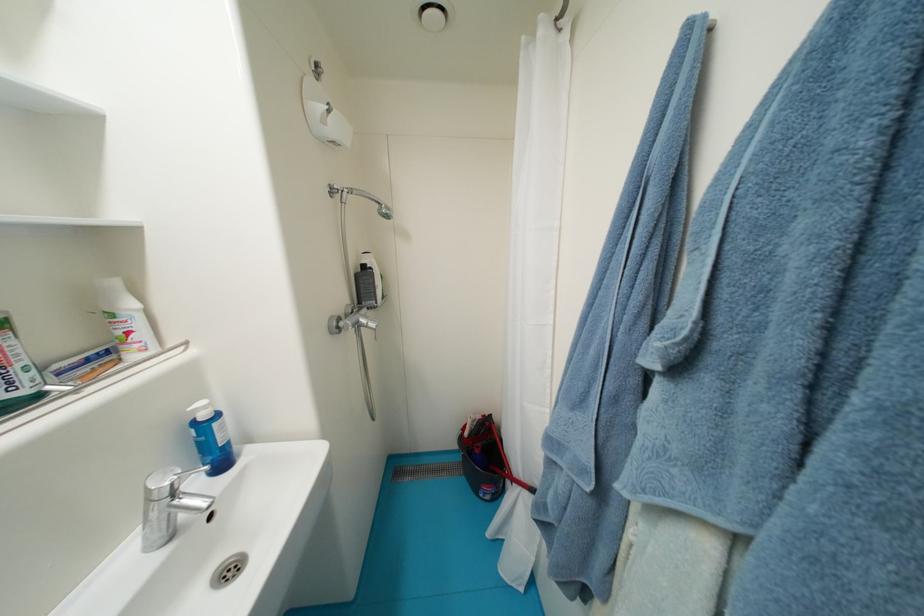
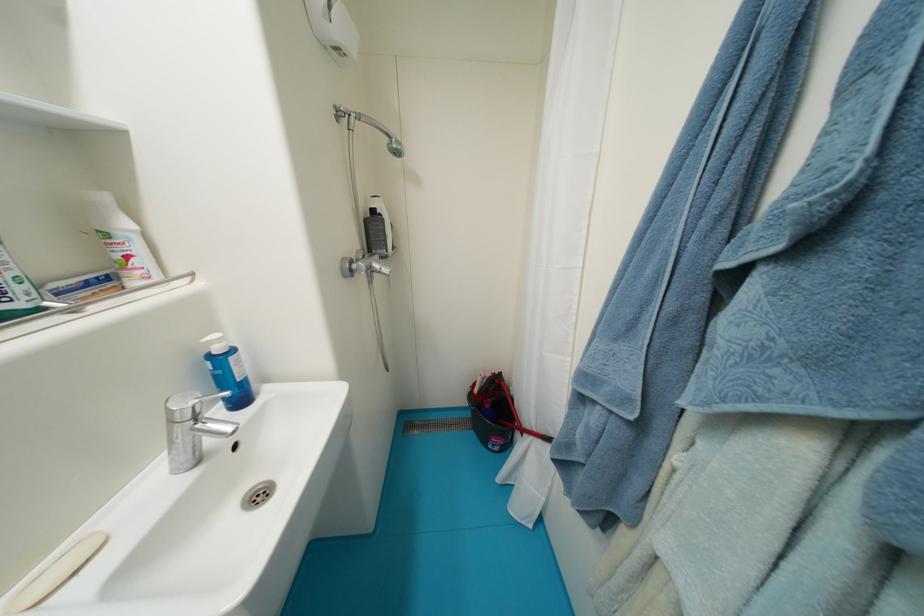
Find the pixel in the second image that matches pixel 64 369 in the first image.

(61, 286)